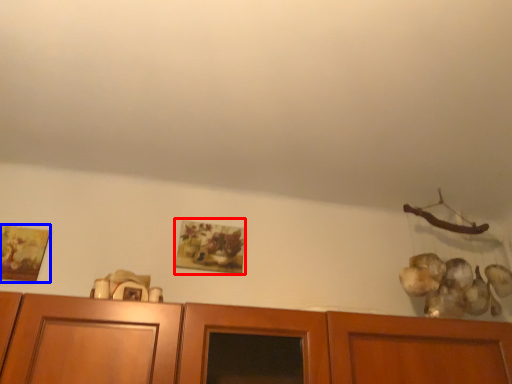
Question: Which object is further to the camera taking this photo, picture frame (highlighted by a red box) or picture frame (highlighted by a blue box)?

Choices:
 (A) picture frame
 (B) picture frame

Answer: (A)